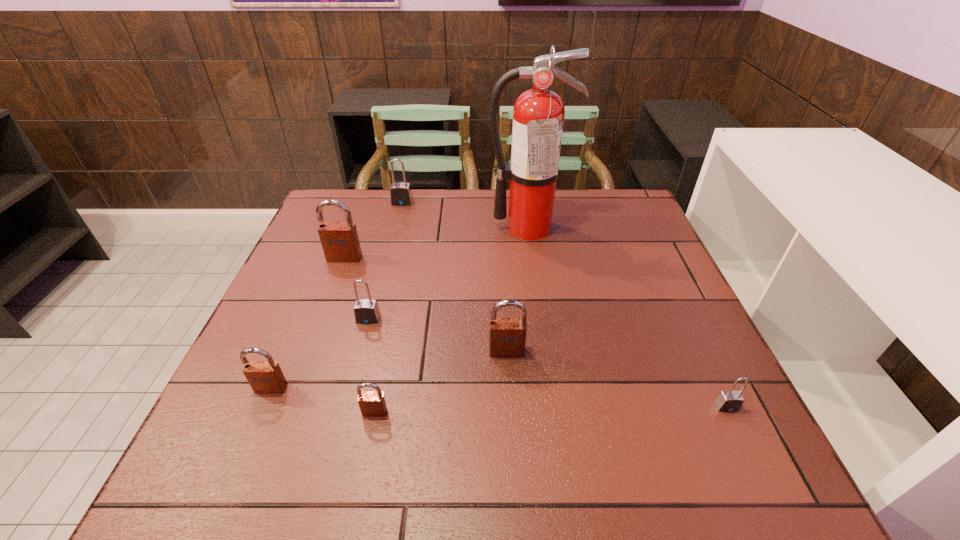
The height and width of the screenshot is (540, 960). Find the location of `vacant space at the right edge of the desktop`. vacant space at the right edge of the desktop is located at coordinates (626, 262).

The image size is (960, 540). I want to click on blank space at the far right corner, so click(x=608, y=218).

The image size is (960, 540). What are the coordinates of `free spot between the smallest gray padlock and the third farthest object` in the screenshot? It's located at [x=536, y=332].

Locate an element on the screen. Image resolution: width=960 pixels, height=540 pixels. free space between the farthest object and the rightmost padlock is located at coordinates (564, 305).

Where is `vacant region between the biggest gray padlock and the sixth farthest object`? Image resolution: width=960 pixels, height=540 pixels. vacant region between the biggest gray padlock and the sixth farthest object is located at coordinates (337, 295).

Find the location of `free space that is in between the fire extinguisher and the smallest brown padlock`. free space that is in between the fire extinguisher and the smallest brown padlock is located at coordinates (451, 320).

Find the location of `vacant space in between the second farthest padlock and the rightmost padlock`. vacant space in between the second farthest padlock and the rightmost padlock is located at coordinates (536, 332).

Where is `vacant point located between the second farthest gray padlock and the fourth nearest padlock`? The width and height of the screenshot is (960, 540). vacant point located between the second farthest gray padlock and the fourth nearest padlock is located at coordinates (438, 335).

This screenshot has height=540, width=960. Identify the location of blank region between the nearest gray padlock and the third smallest brown padlock. (616, 379).

Locate an element on the screen. Image resolution: width=960 pixels, height=540 pixels. vacant area that lies between the third brown padlock from left to right and the fire extinguisher is located at coordinates (451, 320).